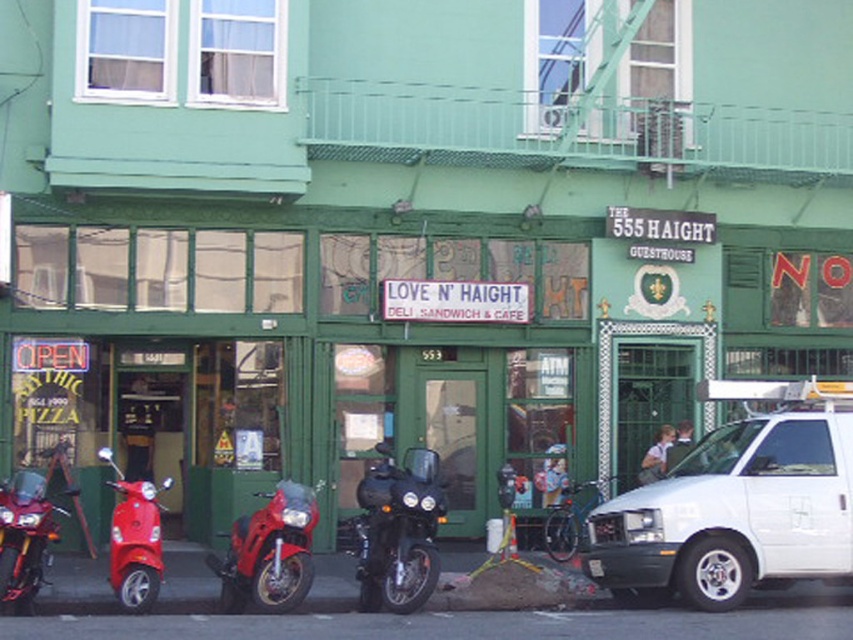
Question: Does white matte van at center lie behind shiny red scooter at lower left?

Choices:
 (A) yes
 (B) no

Answer: (A)

Question: Can you confirm if shiny red motorcycle at center is bigger than shiny red motorcycle at left?

Choices:
 (A) no
 (B) yes

Answer: (B)

Question: Which object is the farthest from the white matte van at center?

Choices:
 (A) shiny red motorcycle at center
 (B) shiny black motorcycle at center
 (C) shiny red motorcycle at left

Answer: (C)

Question: Which point is farther to the camera?

Choices:
 (A) (117, 522)
 (B) (747, 420)
 (C) (431, 536)
 (D) (80, 525)

Answer: (D)

Question: Which object is closer to the camera taking this photo?

Choices:
 (A) shiny red scooter at lower left
 (B) shiny red motorcycle at center
 (C) shiny red motorcycle at left

Answer: (C)

Question: Does shiny black motorcycle at center appear under shiny red scooter at lower left?

Choices:
 (A) no
 (B) yes

Answer: (A)